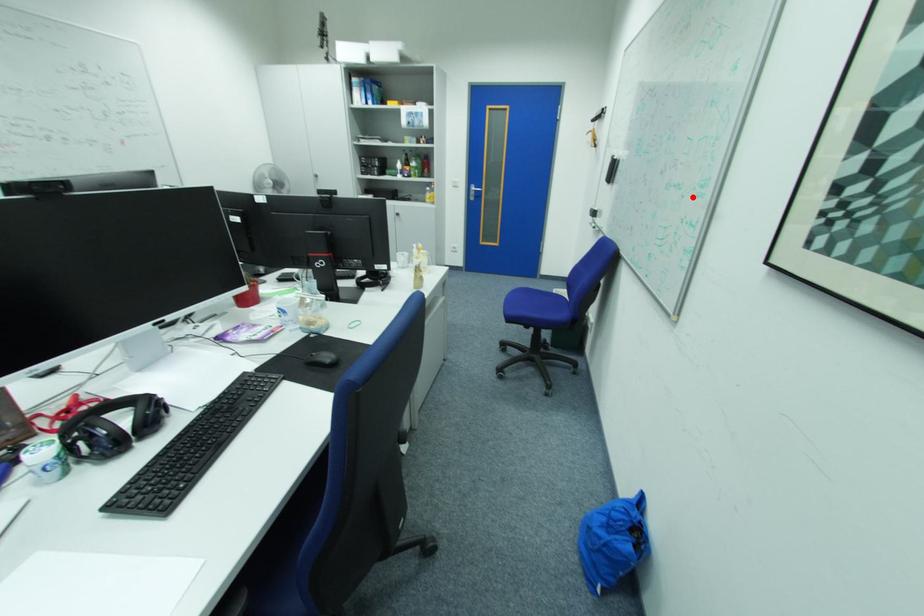
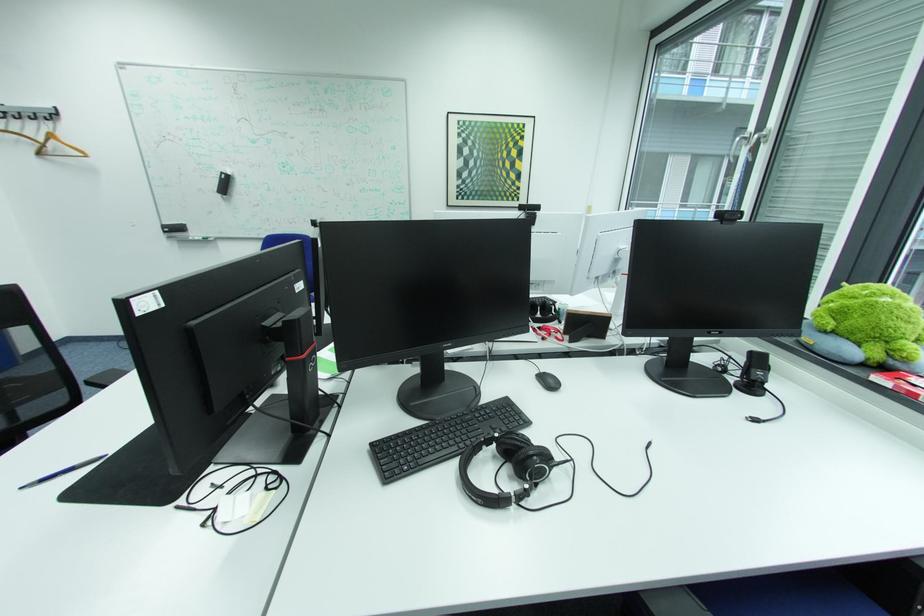
Question: I am providing you with two images of the same scene from different viewpoints. Given a red point in image1, look at the same physical point in image2. Is it:

Choices:
 (A) Closer to the viewpoint
 (B) Farther from the viewpoint

Answer: (A)